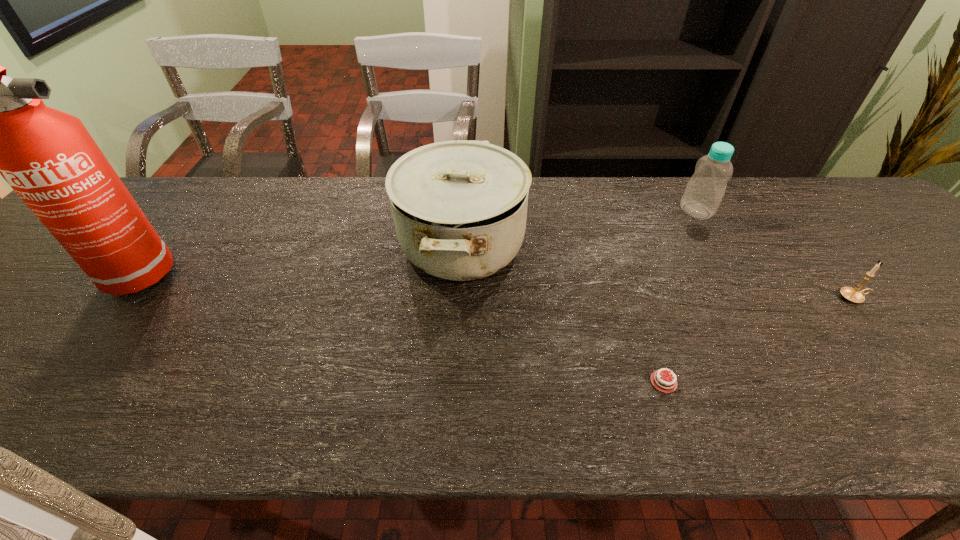
This screenshot has width=960, height=540. I want to click on free space at the far right corner, so click(816, 188).

Find the location of a particular element. vacant space that's between the fourth object from right to left and the bottle is located at coordinates (579, 227).

You are a GUI agent. You are given a task and a screenshot of the screen. Output one action in this format:
    pyautogui.click(x=<x>, y=<y>)
    Task: Click on the vacant space that's between the bottle and the second object from left to right
    The width and height of the screenshot is (960, 540).
    Given the screenshot: What is the action you would take?
    pyautogui.click(x=579, y=227)

Find the location of a particular element. free space between the candle holder and the shortest object is located at coordinates (758, 340).

Find the location of `empty space between the second object from right to left and the saucepan`. empty space between the second object from right to left and the saucepan is located at coordinates (579, 227).

You are a GUI agent. You are given a task and a screenshot of the screen. Output one action in this format:
    pyautogui.click(x=<x>, y=<y>)
    Task: Click on the free spot between the bottle and the second object from left to right
    The image size is (960, 540).
    Given the screenshot: What is the action you would take?
    pyautogui.click(x=579, y=227)

Image resolution: width=960 pixels, height=540 pixels. What are the coordinates of `free point between the second object from right to left and the nearest object` in the screenshot? It's located at (680, 296).

The height and width of the screenshot is (540, 960). What are the coordinates of `free space between the fire extinguisher and the nearest object` in the screenshot? It's located at (395, 329).

Locate an element on the screen. The height and width of the screenshot is (540, 960). empty location between the chocolate cake and the second shortest object is located at coordinates (758, 340).

This screenshot has width=960, height=540. What are the coordinates of `free space between the second object from left to right and the bottle` in the screenshot? It's located at (579, 227).